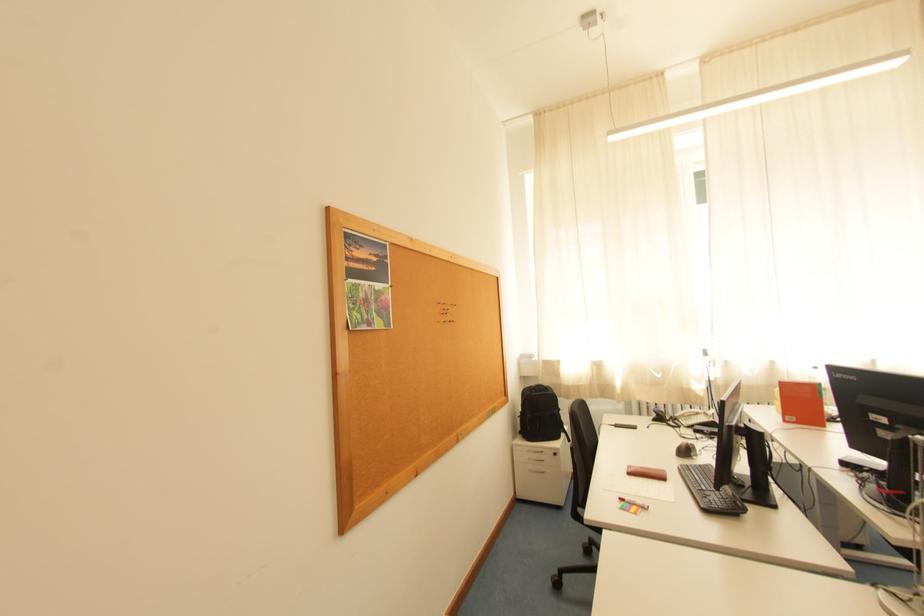
In order to click on black speaker in this screenshot , I will do `click(758, 468)`.